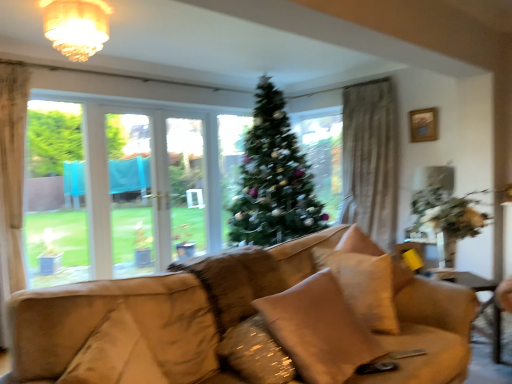
Question: Which direction should I rotate to look at beige fabric pillow at center, the second pillow when ordered from front to back?

Choices:
 (A) right
 (B) left

Answer: (A)

Question: Can you see matte glass chandelier at upper center touching green matte christmas tree at center?

Choices:
 (A) no
 (B) yes

Answer: (A)

Question: Would you say matte glass chandelier at upper center is outside green matte christmas tree at center?

Choices:
 (A) no
 (B) yes

Answer: (B)

Question: Does matte glass chandelier at upper center contain green matte christmas tree at center?

Choices:
 (A) yes
 (B) no

Answer: (B)

Question: Is matte glass chandelier at upper center facing towards green matte christmas tree at center?

Choices:
 (A) no
 (B) yes

Answer: (A)

Question: From the image's perspective, does matte glass chandelier at upper center appear higher than green matte christmas tree at center?

Choices:
 (A) yes
 (B) no

Answer: (A)

Question: Is green matte christmas tree at center at the back of matte glass chandelier at upper center?

Choices:
 (A) no
 (B) yes

Answer: (A)

Question: Can you confirm if matte glass chandelier at upper center is shorter than beige fabric pillow at center, which appears as the 1th pillow when viewed from the front?

Choices:
 (A) yes
 (B) no

Answer: (A)

Question: Could you tell me if matte glass chandelier at upper center is turned towards beige fabric pillow at center, which appears as the 1th pillow when viewed from the front?

Choices:
 (A) no
 (B) yes

Answer: (A)

Question: From the image's perspective, is matte glass chandelier at upper center on beige fabric pillow at center, which appears as the 1th pillow when viewed from the front?

Choices:
 (A) yes
 (B) no

Answer: (A)

Question: Would you say matte glass chandelier at upper center is a long distance from beige fabric pillow at center, the third pillow positioned from the back?

Choices:
 (A) yes
 (B) no

Answer: (A)

Question: Is matte glass chandelier at upper center closer to camera compared to beige fabric pillow at center, the third pillow positioned from the back?

Choices:
 (A) yes
 (B) no

Answer: (B)

Question: From a real-world perspective, does matte glass chandelier at upper center stand above beige fabric pillow at center, the third pillow positioned from the back?

Choices:
 (A) no
 (B) yes

Answer: (B)

Question: Is beige fabric pillow at center, the second pillow when ordered from front to back, not near beige fabric pillow at center, which appears as the 1th pillow when viewed from the front?

Choices:
 (A) yes
 (B) no

Answer: (B)